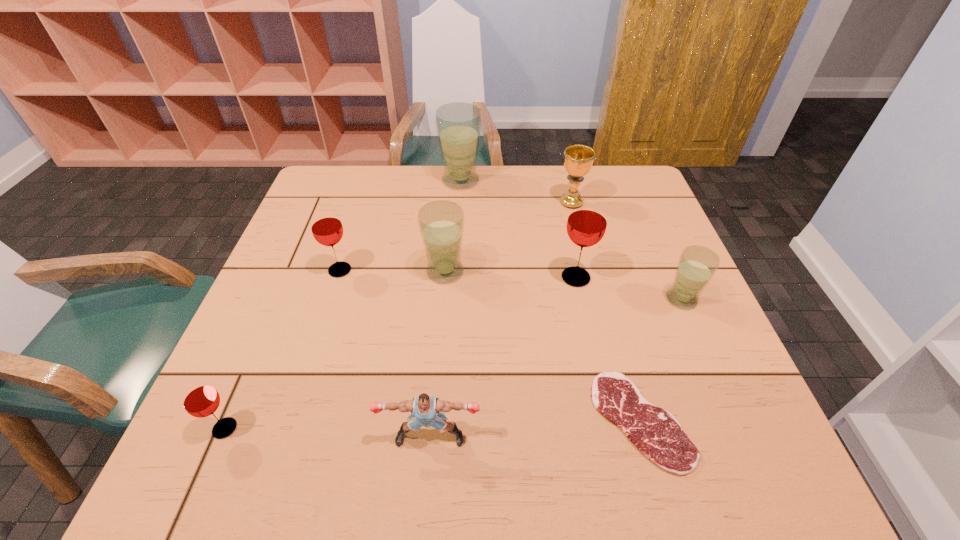
Find the location of a particular element. blank region between the biggest blue glass and the eighth nearest object is located at coordinates (516, 192).

At what (x,y) coordinates should I click in order to perform the action: click on free space that is in between the chalice and the steak. Please return your answer as a coordinate pair (x, y). Image resolution: width=960 pixels, height=540 pixels. Looking at the image, I should click on (606, 312).

Identify the location of empty location between the red puncher and the shortest object. The height and width of the screenshot is (540, 960). (536, 429).

This screenshot has width=960, height=540. What are the coordinates of `free point between the leftmost object and the chalice` in the screenshot? It's located at (398, 315).

Where is `the fourth closest object to the rightmost glass`? The width and height of the screenshot is (960, 540). the fourth closest object to the rightmost glass is located at coordinates (441, 223).

Point out which object is positioned as the third nearest to the red steak. Please provide its 2D coordinates. Your answer should be formatted as a tuple, i.e. [(x, y)], where the tuple contains the x and y coordinates of a point satisfying the conditions above.

[(587, 221)]

What are the coordinates of `glass that stands as the third closest to the fifth glass from right to left` in the screenshot? It's located at (200, 399).

Identify which glass is the fourth nearest to the biggest blue glass. Please provide its 2D coordinates. Your answer should be formatted as a tuple, i.e. [(x, y)], where the tuple contains the x and y coordinates of a point satisfying the conditions above.

[(697, 265)]

Find the location of a particular element. red glass that is the closest to the red steak is located at coordinates (587, 221).

Locate an element on the screen. The width and height of the screenshot is (960, 540). red glass identified as the closest to the second biggest blue glass is located at coordinates (327, 229).